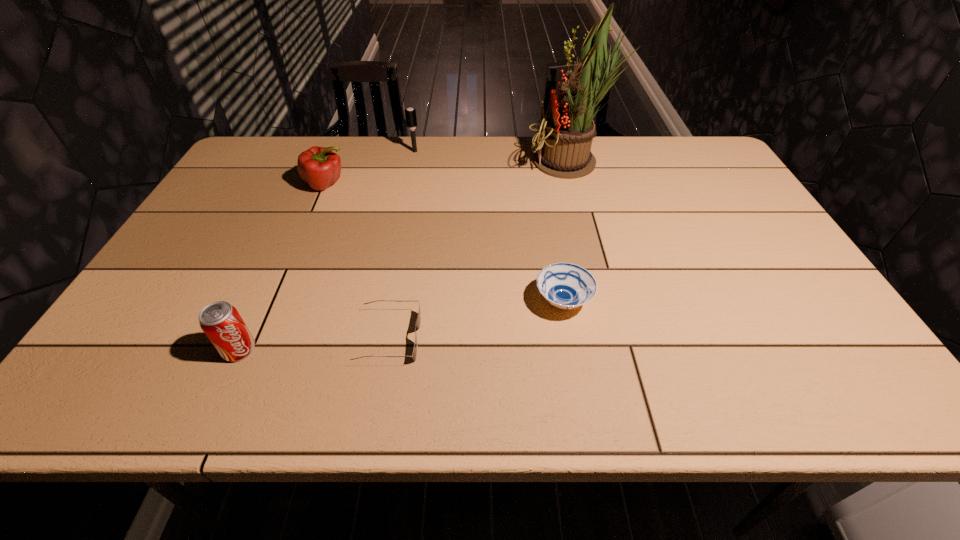
Find the location of a particular element. This screenshot has width=960, height=540. blank space at the right edge of the desktop is located at coordinates (728, 178).

Find the location of a particular element. Image resolution: width=960 pixels, height=540 pixels. vacant area at the far left corner of the desktop is located at coordinates 248,167.

This screenshot has width=960, height=540. I want to click on vacant space that is in between the hairbrush and the soda can, so click(x=327, y=251).

The image size is (960, 540). Identify the location of free space between the fifth shortest object and the soup bowl. (489, 226).

In order to click on free space between the soda can and the sunglasses in this screenshot , I will do `click(314, 343)`.

Identify the location of unoccupied position between the soda can and the hairbrush. (327, 251).

Image resolution: width=960 pixels, height=540 pixels. I want to click on vacant point located between the second tallest object and the bell pepper, so click(371, 167).

You are a GUI agent. You are given a task and a screenshot of the screen. Output one action in this format:
    pyautogui.click(x=<x>, y=<y>)
    Task: Click on the free space between the tallest object and the bell pepper
    
    Given the screenshot: What is the action you would take?
    pyautogui.click(x=449, y=173)

The image size is (960, 540). Identify the location of vacant area between the soda can and the flower arrangement. (406, 256).

Find the location of a particular element. Image resolution: width=960 pixels, height=540 pixels. free spot between the soup bowl and the second tallest object is located at coordinates (489, 226).